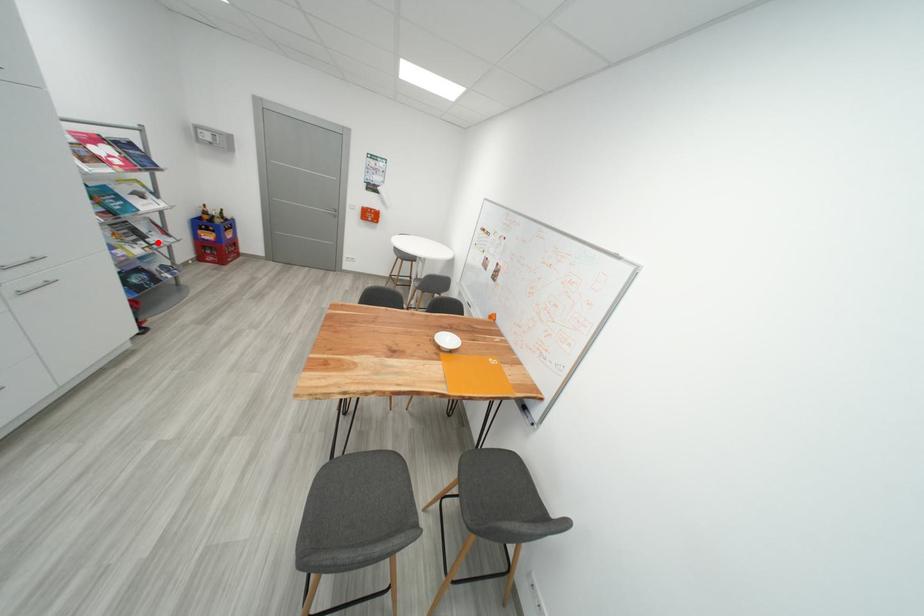
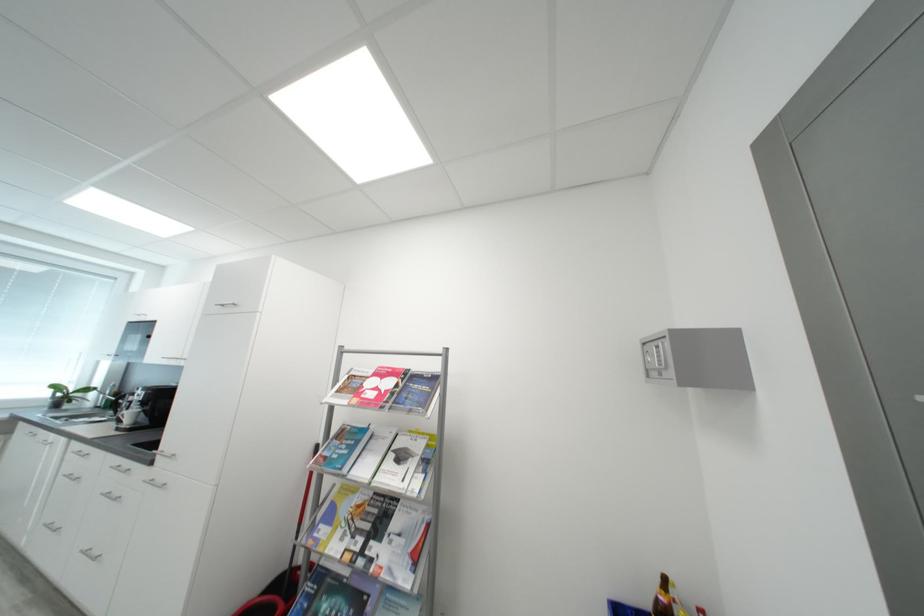
The point at the highlighted location is marked in the first image. Where is the corresponding point in the second image?

(380, 549)